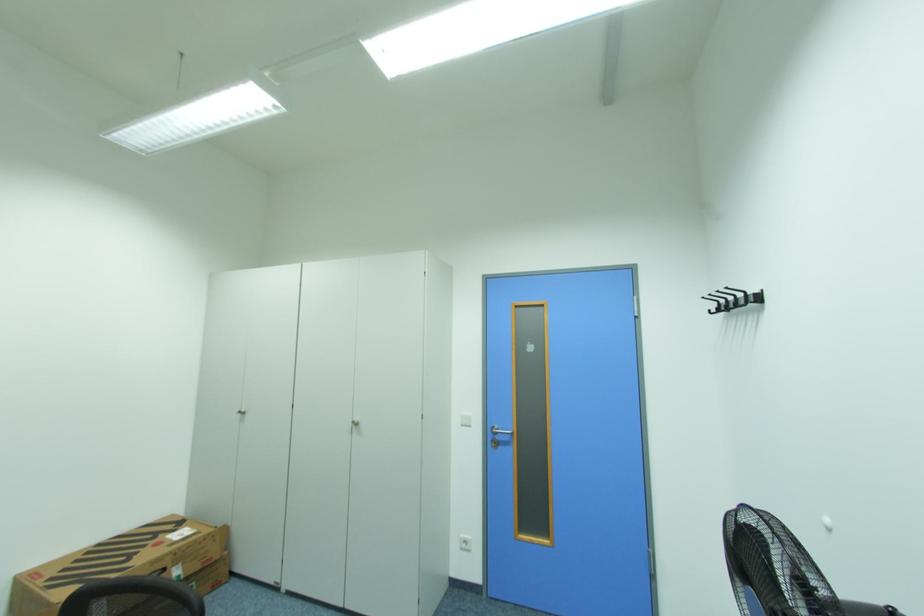
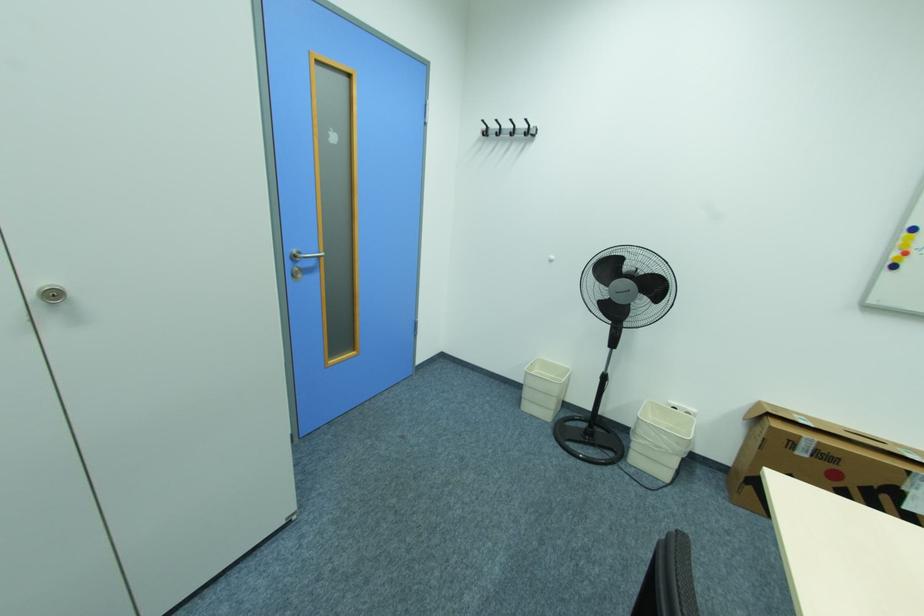
Find the pixel in the second image that matches the point at 361,424 in the first image.

(64, 294)